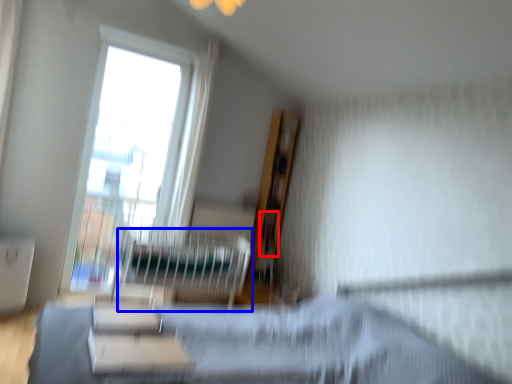
Question: Which point is further to the camera, book (highlighted by a red box) or hospital bed (highlighted by a blue box)?

Choices:
 (A) book
 (B) hospital bed

Answer: (A)